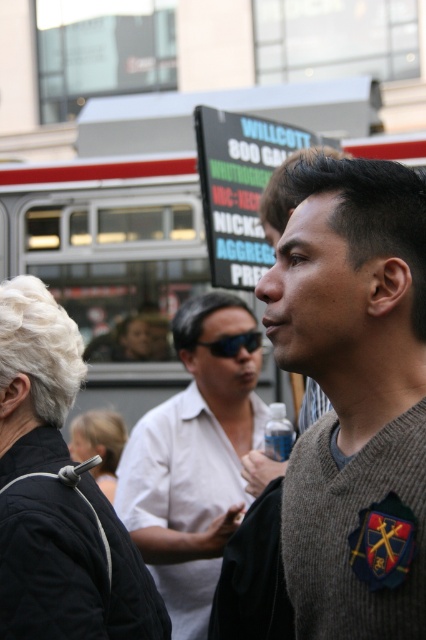
You are a delivery person needing to place a package between the black fabric at upper left and the white shirt at center. The package requires a minimum of 6 feet of space to ensure safety. Based on the scene description, can you safely place the package there?

The black fabric at upper left is 5.57 feet away from the white shirt at center. Since the required minimum distance is 6 feet and the actual distance is less than that, placing the package between them would not meet the safety requirement.

You are a fashion designer analyzing the image. You need to determine which fabric would be more suitable for a winter coat. Based on the thickness of the black fabric at upper left and white shirt at center, which one would you choose?

The black fabric at upper left is thinner than the white shirt at center, so the white shirt at center would be more suitable for a winter coat due to its greater thickness.